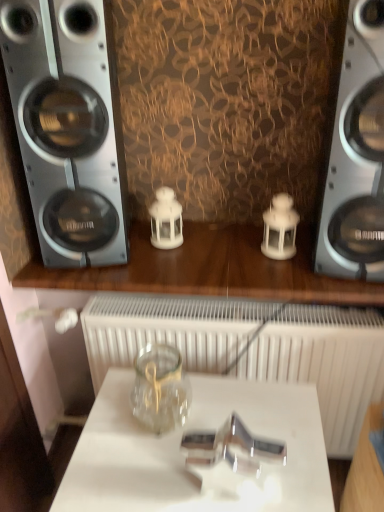
Locate an element on the screen. The width and height of the screenshot is (384, 512). free space to the left of transparent glass jar at center is located at coordinates (107, 414).